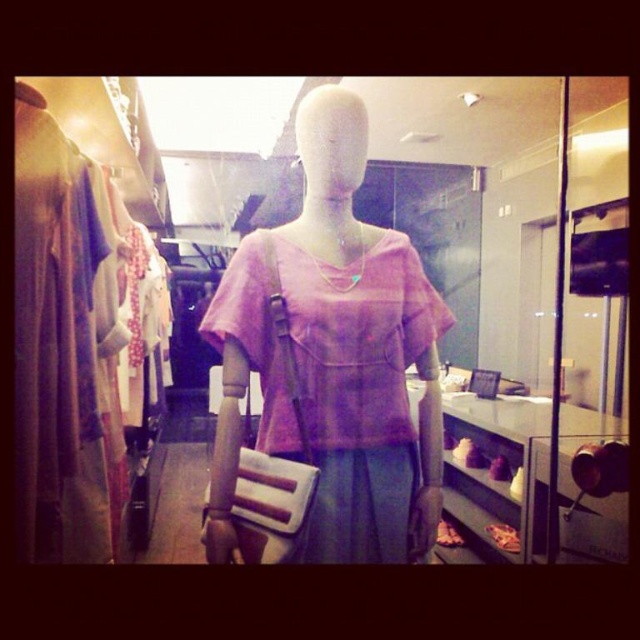
Can you confirm if matte pink fabric dress at center is taller than pink fabric dress at center?

In fact, matte pink fabric dress at center may be shorter than pink fabric dress at center.

Is point (32, 124) behind point (301, 554)?

Yes, point (32, 124) is farther from viewer.

Where is `matte pink fabric dress at center`? Image resolution: width=640 pixels, height=640 pixels. matte pink fabric dress at center is located at coordinates (333, 356).